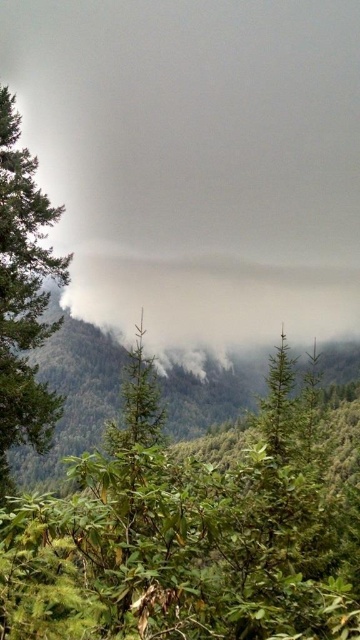
Is point (258, 305) closer to viewer compared to point (255, 488)?

No, it is not.

Can you confirm if gray foggy cloud at center is smaller than green leafy tree at center?

Actually, gray foggy cloud at center might be larger than green leafy tree at center.

Describe the element at coordinates (198, 163) in the screenshot. I see `gray foggy cloud at center` at that location.

What are the coordinates of `gray foggy cloud at center` in the screenshot? It's located at pos(198,163).

Between point (19, 566) and point (18, 340), which one is positioned behind?

The point (18, 340) is more distant.

The image size is (360, 640). What do you see at coordinates (178, 536) in the screenshot?
I see `green leafy tree at center` at bounding box center [178, 536].

Does point (87, 461) come in front of point (48, 257)?

Yes.

Where is `green leafy tree at center`? green leafy tree at center is located at coordinates (178, 536).

Based on the photo, does gray foggy cloud at center have a lesser width compared to green matte tree at left?

In fact, gray foggy cloud at center might be wider than green matte tree at left.

Based on the photo, is gray foggy cloud at center shorter than green matte tree at left?

In fact, gray foggy cloud at center may be taller than green matte tree at left.

What do you see at coordinates (198, 163) in the screenshot? I see `gray foggy cloud at center` at bounding box center [198, 163].

The image size is (360, 640). I want to click on gray foggy cloud at center, so click(x=198, y=163).